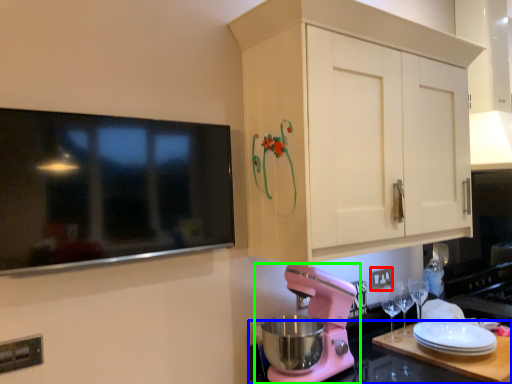
Question: Which is nearer to the electric outlet (highlighted by a red box)? countertop (highlighted by a blue box) or mixer (highlighted by a green box).

Choices:
 (A) countertop
 (B) mixer

Answer: (A)